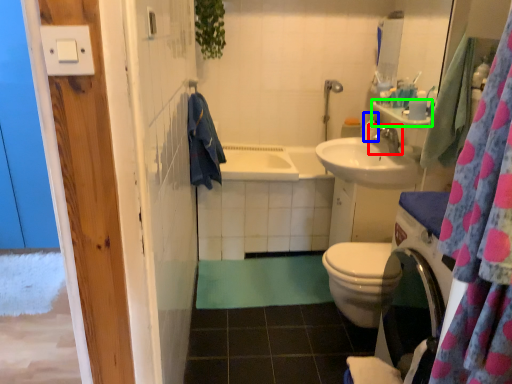
Question: Which object is the farthest from tap (highlighted by a red box)? Choose among these: toiletry (highlighted by a blue box) or counter top (highlighted by a green box).

Choices:
 (A) toiletry
 (B) counter top

Answer: (B)